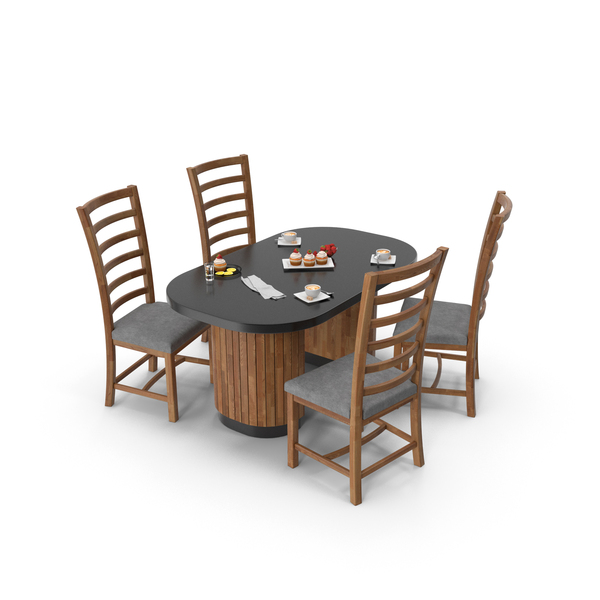
Locate an element on the screen. Image resolution: width=600 pixels, height=600 pixels. chair is located at coordinates point(331,402).